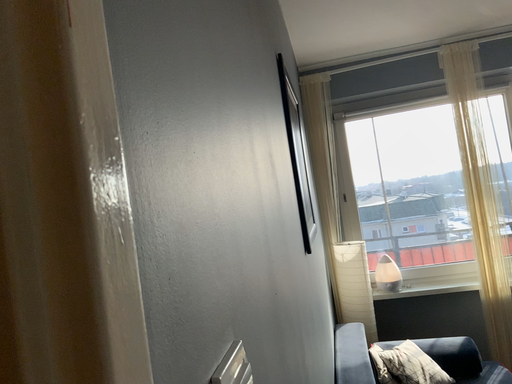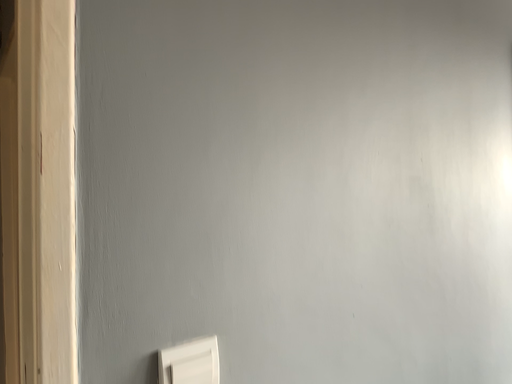
Question: How did the camera likely rotate when shooting the video?

Choices:
 (A) rotated left
 (B) rotated right

Answer: (A)